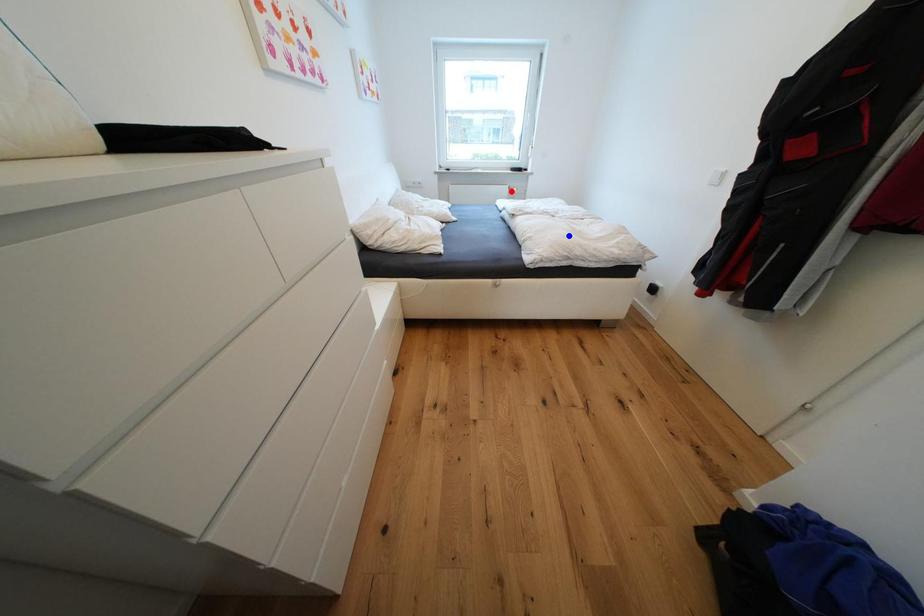
Question: Which of the two points in the image is closer to the camera?

Choices:
 (A) Blue point is closer.
 (B) Red point is closer.

Answer: (A)